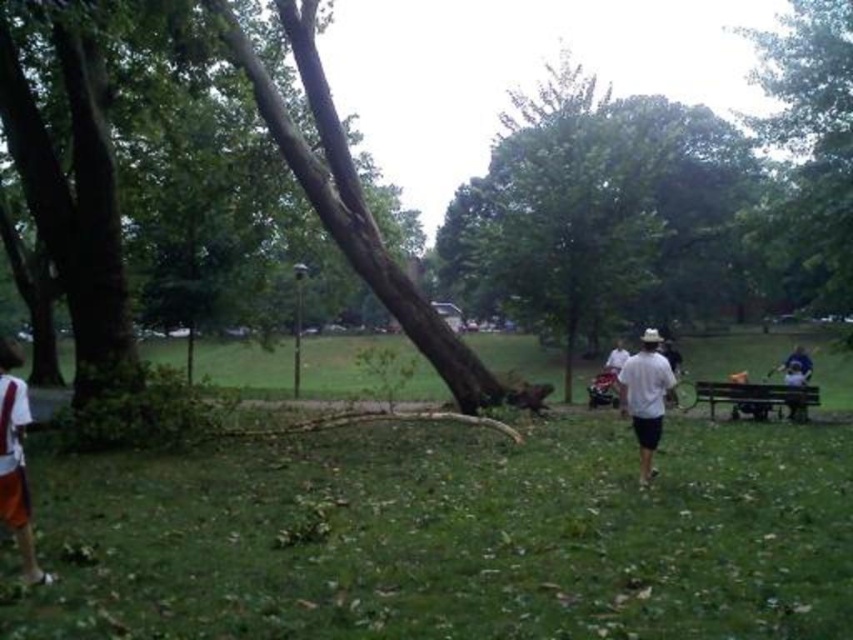
This screenshot has width=853, height=640. Identify the location of green grassy field at center. (453, 536).

In the scene shown: Does green grassy field at center have a smaller size compared to orange shorts at left?

Actually, green grassy field at center might be larger than orange shorts at left.

Where is `green grassy field at center`? Image resolution: width=853 pixels, height=640 pixels. green grassy field at center is located at coordinates (453, 536).

You are a GUI agent. You are given a task and a screenshot of the screen. Output one action in this format:
    pyautogui.click(x=<x>, y=<y>)
    Task: Click on the green grassy field at center
    This screenshot has width=853, height=640.
    Given the screenshot: What is the action you would take?
    pyautogui.click(x=453, y=536)

Does brown rough bark tree at center come in front of white matte shirt at center?

No, it is not.

Does brown rough bark tree at center have a lesser height compared to white matte shirt at center?

No.

The height and width of the screenshot is (640, 853). Find the location of `brown rough bark tree at center`. brown rough bark tree at center is located at coordinates (665, 196).

Locate an element on the screen. brown rough bark tree at center is located at coordinates (665, 196).

Does point (532, 632) come in front of point (834, 198)?

Yes, point (532, 632) is in front of point (834, 198).

Does point (293, 486) come farther from viewer compared to point (830, 256)?

No, (293, 486) is in front of (830, 256).

Which is in front, point (595, 420) or point (819, 120)?

Point (595, 420) is in front.

Where is `green grassy field at center`? green grassy field at center is located at coordinates (453, 536).